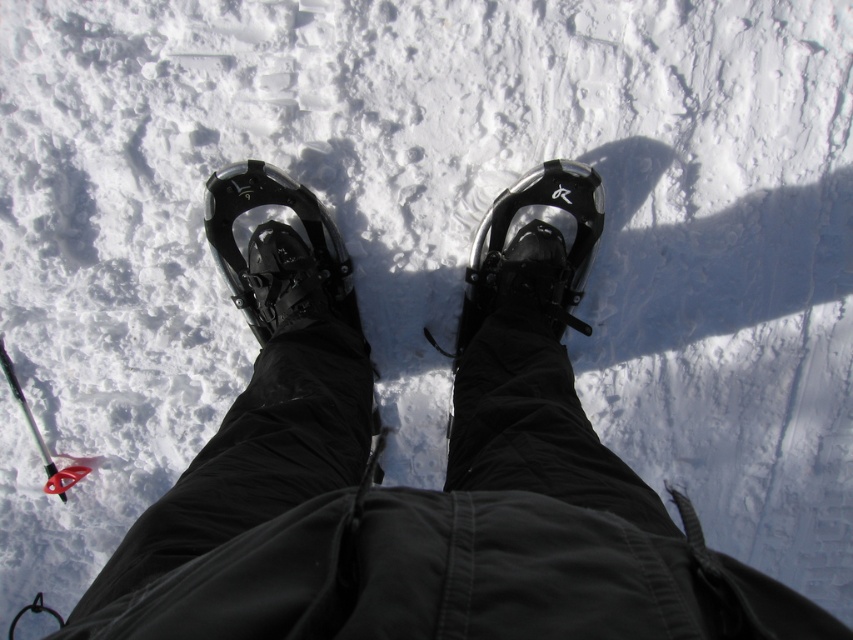
You are planning to take a photo of the snowshoes from above. Which of the two snowshoes, the black matte snowshoes at center or the black glossy snowshoe at center, would appear higher in the image?

The black glossy snowshoe at center appears higher in the image because the black matte snowshoes at center is located below it.

You are trying to determine which snowshoe is higher in the image. You see the black matte snowshoes at center and the black glossy snowshoe at center. Which one is taller?

The black matte snowshoes at center is taller than the black glossy snowshoe at center according to the description.

You are standing on a snowy slope and need to place a small flag exactly at the point marked by the coordinates point [416,488]. Given that the snowshoes are at the center, where should you place the flag relative to the black matte snowshoes at center?

The point [416,488] corresponds to the black matte snowshoes at center, so you should place the flag directly on the black matte snowshoes at center.